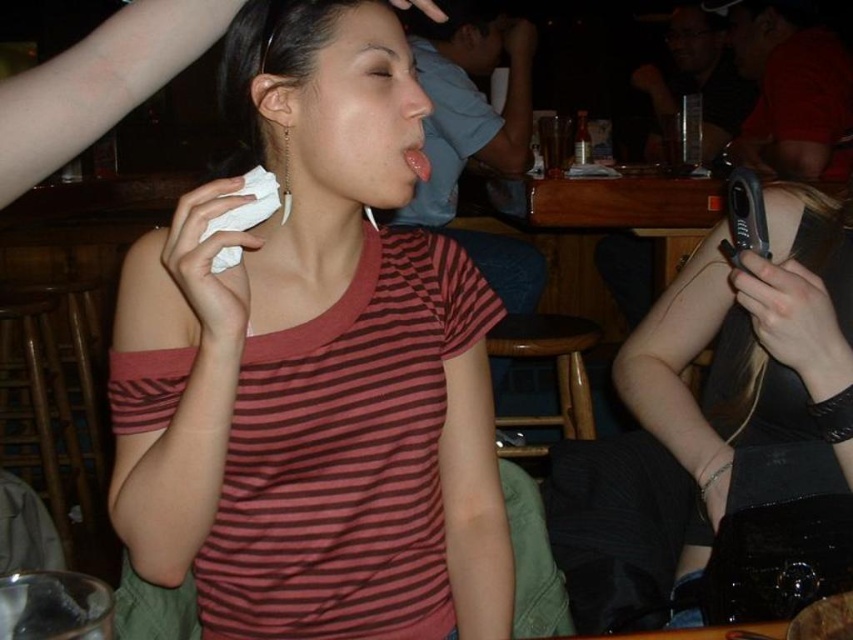
You are standing at the origin point in the image and want to move towards the two points labeled as point (x=405, y=51) and point (x=416, y=108). Which point would you reach first?

You would reach point (x=416, y=108) first because it is closer to the origin than point (x=405, y=51), which is further away.

You are a photographer trying to capture a candid shot of the striped cotton shirt at center and the matte black phone at center. Since you want both objects to be clearly visible in the frame, which object should you focus on first to ensure proper depth of field?

The striped cotton shirt at center is taller than the matte black phone at center, so focusing on the taller object first will help ensure both are in focus.

You are a bartender who needs to reach the matte black phone at center to take an urgent call. You are currently holding a tray of drinks and standing near the striped cotton shirt at center. Can you safely answer the phone without spilling the drinks?

The distance between the striped cotton shirt at center and the matte black phone at center is 16.63 inches. Since you are already near the striped cotton shirt at center, you can safely reach the matte black phone at center within that distance without moving too far, minimizing the risk of spilling the drinks.